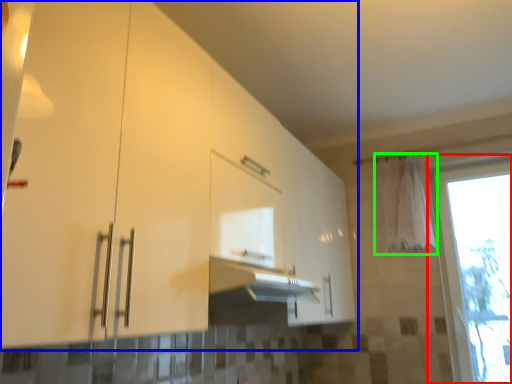
Question: Estimate the real-world distances between objects in this image. Which object is closer to window (highlighted by a red box), cabinetry (highlighted by a blue box) or curtain (highlighted by a green box)?

Choices:
 (A) cabinetry
 (B) curtain

Answer: (B)